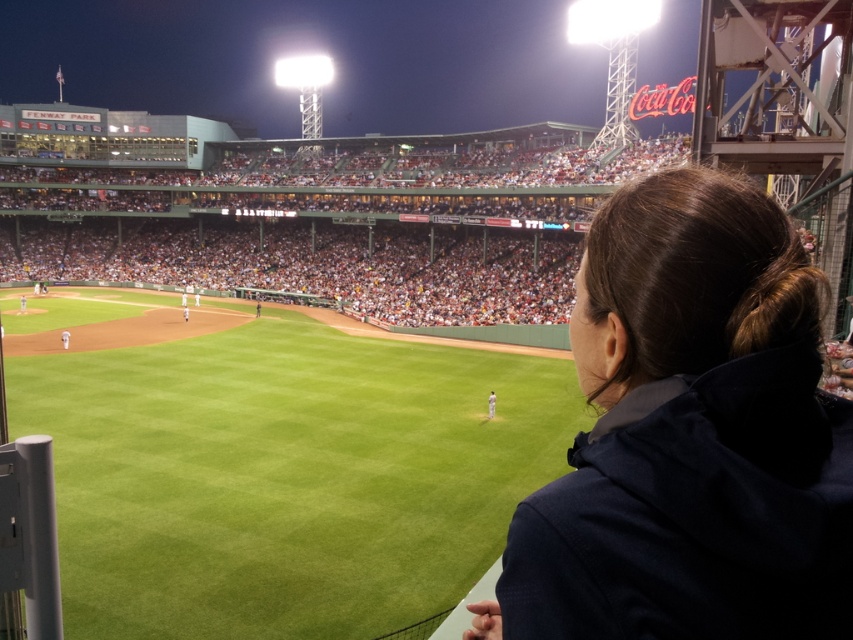
You are a photographer at Fenway Park and want to capture a photo that includes both the green grass baseball field at center and the white jersey uniform at center. Which object should you focus on first to ensure both are in sharp focus?

The green grass baseball field at center is taller than the white jersey uniform at center, so you should focus on the green grass baseball field at center first to ensure both are in sharp focus.

You are a photographer at Fenway Park during a night game. You want to capture a photo that includes both the green grass baseball field at center and the white jersey uniform at center. Based on their positions, which object should appear higher in your photo?

The green grass baseball field at center should appear higher in the photo because it is positioned above the white jersey uniform at center.

You are a photographer at Fenway Park and want to capture a photo that includes both the dark blue jacket at upper right and the green grass baseball field at center. Which object will appear smaller in the photo?

The dark blue jacket at upper right will appear smaller in the photo because it is closer to the camera than the green grass baseball field at center, making it appear smaller in the frame.